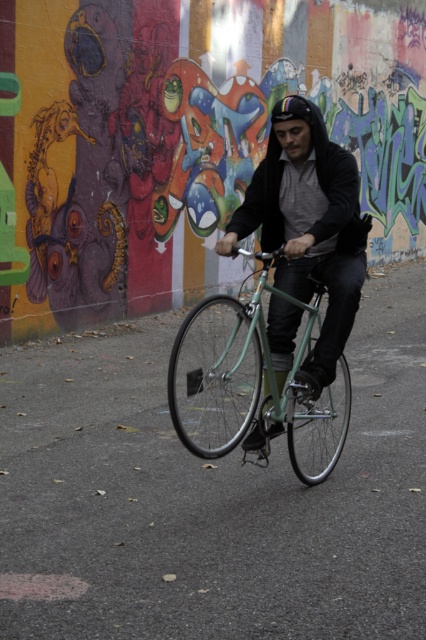
Question: Does matte black jacket at center appear on the left side of metallic green bicycle at center?

Choices:
 (A) yes
 (B) no

Answer: (B)

Question: Among these points, which one is nearest to the camera?

Choices:
 (A) (333, 116)
 (B) (245, 417)

Answer: (B)

Question: Is multicolored graffiti wall at center thinner than matte black jacket at center?

Choices:
 (A) yes
 (B) no

Answer: (B)

Question: Considering the real-world distances, which object is farthest from the metallic green bicycle at center?

Choices:
 (A) rainbow reflective helmet at center
 (B) matte black jacket at center
 (C) multicolored graffiti wall at center

Answer: (C)

Question: Estimate the real-world distances between objects in this image. Which object is farther from the metallic green bicycle at center?

Choices:
 (A) rainbow reflective helmet at center
 (B) matte black jacket at center
 (C) multicolored graffiti wall at center

Answer: (C)

Question: Is multicolored graffiti wall at center bigger than matte black jacket at center?

Choices:
 (A) yes
 (B) no

Answer: (A)